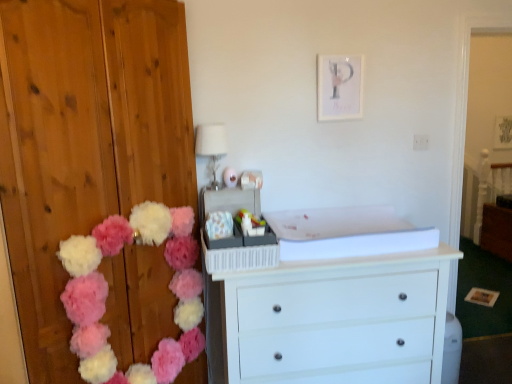
Question: Does fluffy fabric pom-poms at left lie in front of white glossy dresser at center?

Choices:
 (A) yes
 (B) no

Answer: (B)

Question: Can you confirm if fluffy fabric pom-poms at left is wider than white glossy dresser at center?

Choices:
 (A) no
 (B) yes

Answer: (A)

Question: Considering the relative positions of fluffy fabric pom-poms at left and white glossy dresser at center in the image provided, is fluffy fabric pom-poms at left behind white glossy dresser at center?

Choices:
 (A) yes
 (B) no

Answer: (A)

Question: Can we say fluffy fabric pom-poms at left lies outside white glossy dresser at center?

Choices:
 (A) yes
 (B) no

Answer: (A)

Question: Can you confirm if fluffy fabric pom-poms at left is taller than white glossy dresser at center?

Choices:
 (A) no
 (B) yes

Answer: (A)

Question: From a real-world perspective, is fluffy fabric pom-poms at left positioned over white glossy dresser at center based on gravity?

Choices:
 (A) no
 (B) yes

Answer: (A)

Question: Is white glass lampshade at upper center oriented towards brown wood cabinet at right?

Choices:
 (A) yes
 (B) no

Answer: (B)

Question: Is the depth of white glass lampshade at upper center less than that of brown wood cabinet at right?

Choices:
 (A) no
 (B) yes

Answer: (B)

Question: Considering the relative sizes of white glass lampshade at upper center and brown wood cabinet at right in the image provided, is white glass lampshade at upper center taller than brown wood cabinet at right?

Choices:
 (A) no
 (B) yes

Answer: (A)

Question: Can you confirm if white glass lampshade at upper center is shorter than brown wood cabinet at right?

Choices:
 (A) yes
 (B) no

Answer: (A)

Question: From the image's perspective, is white glass lampshade at upper center over brown wood cabinet at right?

Choices:
 (A) no
 (B) yes

Answer: (B)

Question: From a real-world perspective, is white glass lampshade at upper center on brown wood cabinet at right?

Choices:
 (A) no
 (B) yes

Answer: (B)

Question: From a real-world perspective, is white painted wood chest of drawers at center physically above brown wood cabinet at right?

Choices:
 (A) no
 (B) yes

Answer: (B)